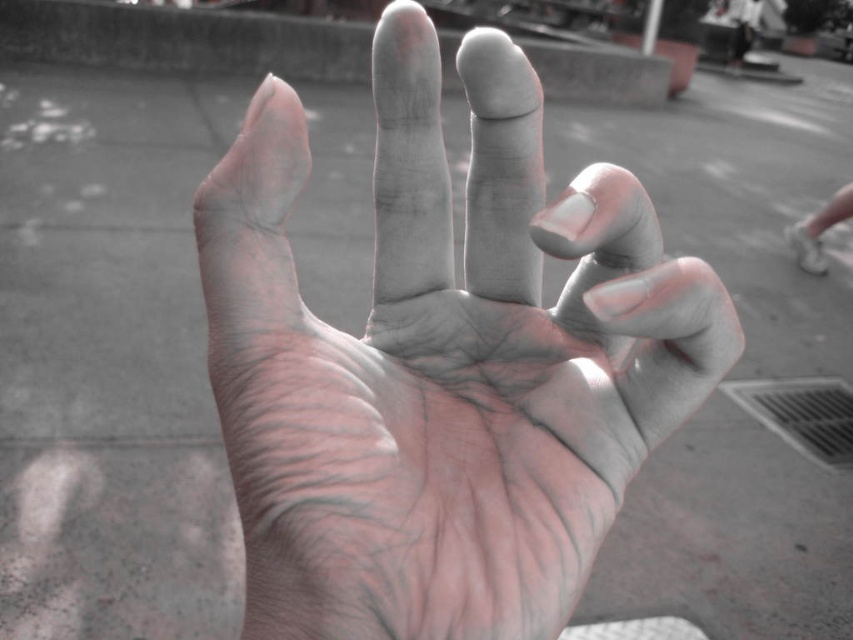
Does point (483, 324) lie behind point (813, 257)?

No.

Which is in front, point (453, 394) or point (805, 243)?

Point (453, 394) is more forward.

The width and height of the screenshot is (853, 640). Find the location of `smooth skin hand at center`. smooth skin hand at center is located at coordinates (442, 364).